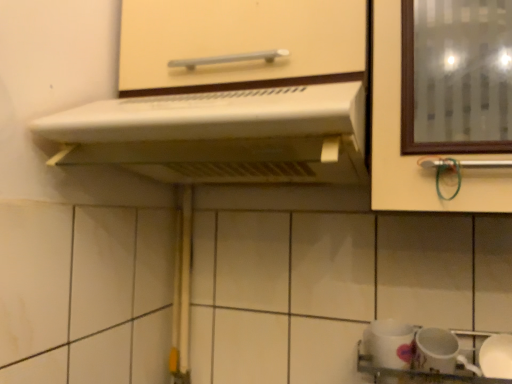
Identify the location of free space above white glossy sink at lower right (from a real-world perspective). (424, 327).